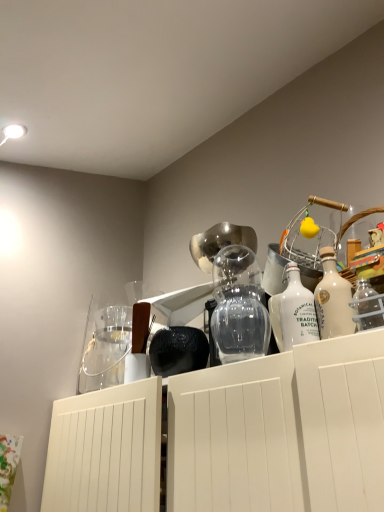
Question: Is white glass bottle at center, which ranks as the 2th bottle in right-to-left order, facing towards transparent glass vase at center?

Choices:
 (A) yes
 (B) no

Answer: (B)

Question: Is white glass bottle at center, arranged as the first bottle when viewed from the left, wider than transparent glass vase at center?

Choices:
 (A) yes
 (B) no

Answer: (B)

Question: Can you confirm if white glass bottle at center, arranged as the first bottle when viewed from the left, is smaller than transparent glass vase at center?

Choices:
 (A) no
 (B) yes

Answer: (B)

Question: Is white glass bottle at center, arranged as the first bottle when viewed from the left, bigger than transparent glass vase at center?

Choices:
 (A) yes
 (B) no

Answer: (B)

Question: Does white glass bottle at center, which ranks as the 2th bottle in right-to-left order, come behind transparent glass vase at center?

Choices:
 (A) no
 (B) yes

Answer: (A)

Question: Considering the positions of clear glass jar at upper left and white glass bottle at center, which ranks as the 2th bottle in right-to-left order, in the image, is clear glass jar at upper left taller or shorter than white glass bottle at center, which ranks as the 2th bottle in right-to-left order,?

Choices:
 (A) short
 (B) tall

Answer: (B)

Question: In the image, is clear glass jar at upper left on the left side or the right side of white glass bottle at center, which ranks as the 2th bottle in right-to-left order?

Choices:
 (A) right
 (B) left

Answer: (B)

Question: From a real-world perspective, relative to white glass bottle at center, arranged as the first bottle when viewed from the left, is clear glass jar at upper left vertically above or below?

Choices:
 (A) below
 (B) above

Answer: (B)

Question: Looking at the image, does clear glass jar at upper left seem bigger or smaller compared to white glass bottle at center, arranged as the first bottle when viewed from the left?

Choices:
 (A) small
 (B) big

Answer: (B)

Question: Is point (286, 324) positioned closer to the camera than point (94, 377)?

Choices:
 (A) closer
 (B) farther

Answer: (A)

Question: Would you say white glass bottle at center, which ranks as the 2th bottle in right-to-left order, is to the left or to the right of clear glass jar at upper left in the picture?

Choices:
 (A) right
 (B) left

Answer: (A)

Question: From the image's perspective, relative to clear glass jar at upper left, is white glass bottle at center, which ranks as the 2th bottle in right-to-left order, above or below?

Choices:
 (A) above
 (B) below

Answer: (A)

Question: Would you say white glass bottle at center, arranged as the first bottle when viewed from the left, is inside or outside clear glass jar at upper left?

Choices:
 (A) inside
 (B) outside

Answer: (B)

Question: Is point (326, 308) closer or farther from the camera than point (79, 378)?

Choices:
 (A) farther
 (B) closer

Answer: (B)

Question: Based on their sizes in the image, would you say white glass bottle at upper right, the 1th bottle from the right, is bigger or smaller than clear glass jar at upper left?

Choices:
 (A) big
 (B) small

Answer: (B)